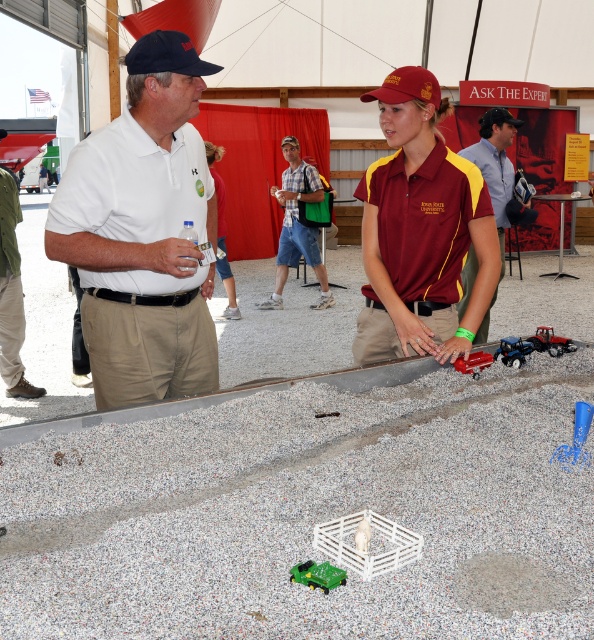
Question: Considering the relative positions of maroon/yellow uniform at center and metallic red truck at lower center in the image provided, where is maroon/yellow uniform at center located with respect to metallic red truck at lower center?

Choices:
 (A) left
 (B) right

Answer: (A)

Question: Considering the relative positions of blue plastic toy truck at center and black fabric baseball cap at upper center in the image provided, where is blue plastic toy truck at center located with respect to black fabric baseball cap at upper center?

Choices:
 (A) below
 (B) above

Answer: (A)

Question: Considering the real-world distances, which object is farthest from the navy blue fabric baseball cap at upper left?

Choices:
 (A) plaid shirt at center
 (B) gray gravel at center

Answer: (A)

Question: Which of these objects is positioned closest to the white matte polo shirt at left?

Choices:
 (A) light blue cotton polo shirt at center
 (B) maroon fabric shirt at center
 (C) green plastic tractor at center
 (D) blue plastic toy truck at center

Answer: (D)

Question: From the image, what is the correct spatial relationship of gray gravel at center in relation to navy blue fabric baseball cap at upper left?

Choices:
 (A) above
 (B) below

Answer: (B)

Question: Which point is closer to the camera taking this photo?

Choices:
 (A) (197, 563)
 (B) (541, 330)
 (C) (574, 436)
 (D) (479, 333)

Answer: (A)